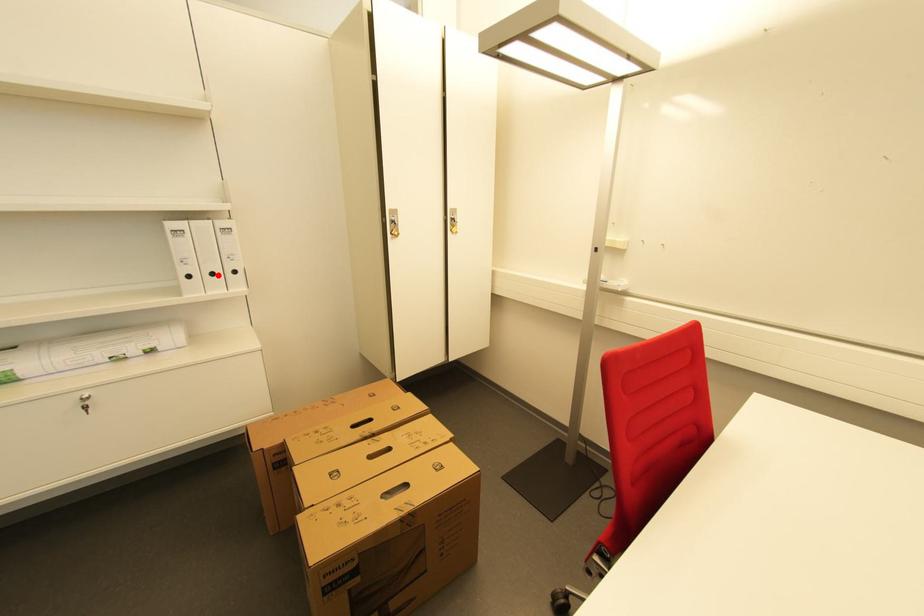
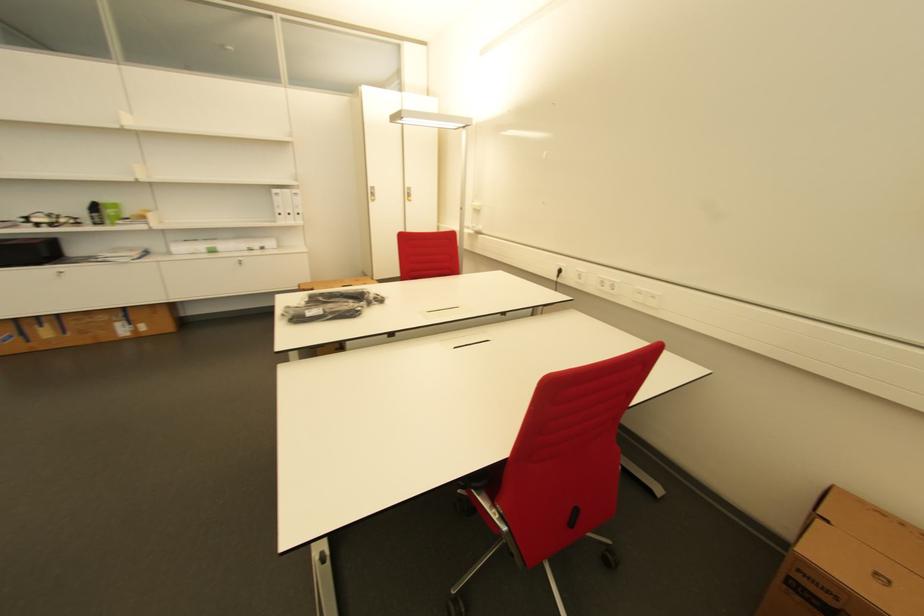
Question: A red point is marked in image1. In image2, is the corresponding 3D point closer to the camera or farther? Reply with the corresponding letter.

Choices:
 (A) The corresponding 3D point is closer.
 (B) The corresponding 3D point is farther.

Answer: (A)